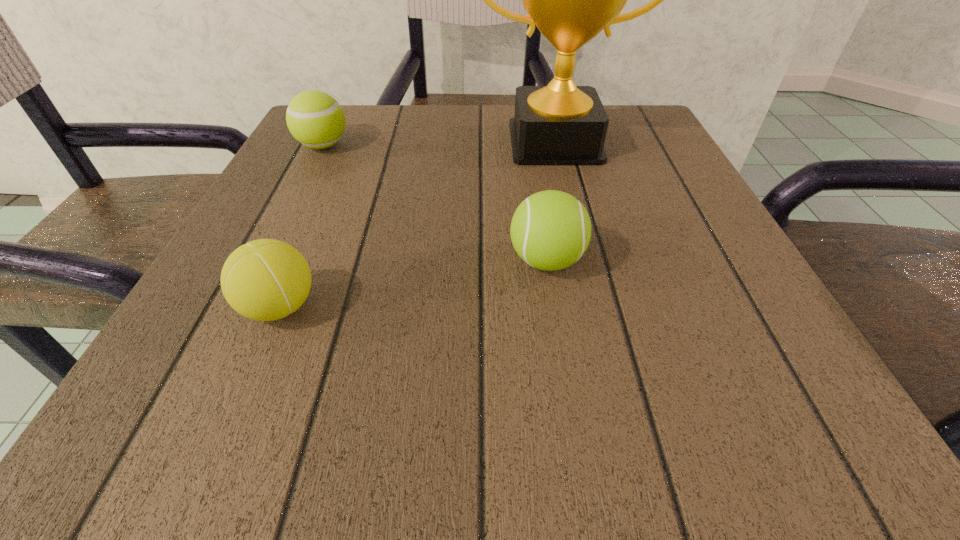
The height and width of the screenshot is (540, 960). Find the location of `award`. award is located at coordinates (571, 0).

Identify the location of the rightmost tennis ball. The image size is (960, 540). (550, 230).

The height and width of the screenshot is (540, 960). Identify the location of the farthest tennis ball. (314, 118).

Locate an element on the screen. The width and height of the screenshot is (960, 540). free space located on the front-facing side of the award is located at coordinates (583, 258).

Where is `free space located 0.150m on the front of the rightmost tennis ball`? The width and height of the screenshot is (960, 540). free space located 0.150m on the front of the rightmost tennis ball is located at coordinates (565, 386).

I want to click on vacant region located on the right of the farthest tennis ball, so click(525, 146).

Locate an element on the screen. This screenshot has width=960, height=540. award that is at the far edge is located at coordinates (571, 0).

I want to click on tennis ball that is at the far edge, so click(314, 118).

The height and width of the screenshot is (540, 960). I want to click on object located at the right edge, so click(571, 0).

You are a GUI agent. You are given a task and a screenshot of the screen. Output one action in this format:
    pyautogui.click(x=<x>, y=<y>)
    Task: Click on the object at the far left corner
    This screenshot has width=960, height=540.
    Given the screenshot: What is the action you would take?
    pyautogui.click(x=314, y=118)